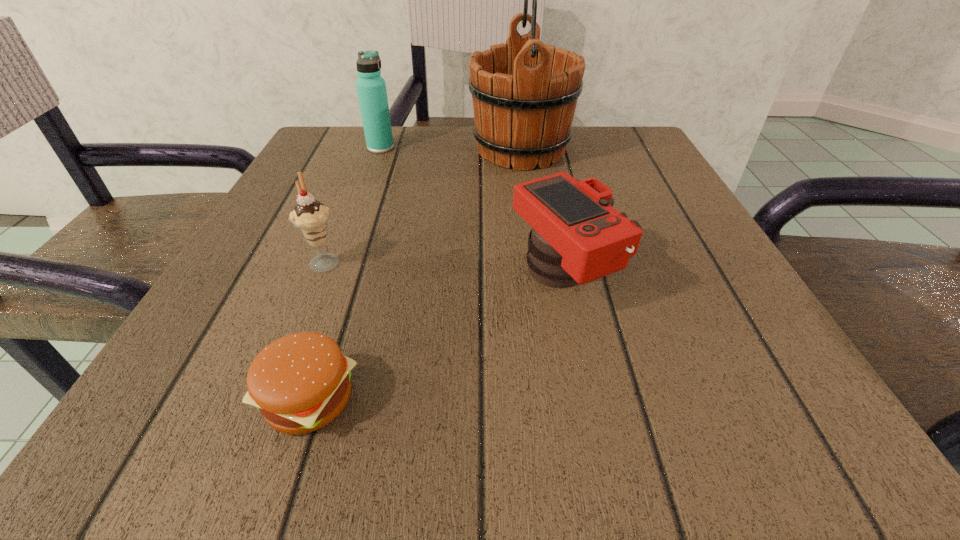
Locate an element on the screen. The width and height of the screenshot is (960, 540). the tallest object is located at coordinates (524, 92).

You are a GUI agent. You are given a task and a screenshot of the screen. Output one action in this format:
    pyautogui.click(x=<x>, y=<y>)
    Task: Click on the second tallest object
    
    Given the screenshot: What is the action you would take?
    pyautogui.click(x=371, y=88)

At what (x,y) coordinates should I click in order to perform the action: click on icecream. Please return your answer as a coordinate pair (x, y). Image resolution: width=960 pixels, height=540 pixels. Looking at the image, I should click on (311, 217).

The width and height of the screenshot is (960, 540). I want to click on camera, so click(577, 236).

Find the location of a particular element. the nearest object is located at coordinates (300, 382).

At what (x,y) coordinates should I click in order to perform the action: click on hamburger. Please return your answer as a coordinate pair (x, y). Looking at the image, I should click on (300, 382).

This screenshot has width=960, height=540. What are the coordinates of `vacant space situated on the front of the tallest object` in the screenshot? It's located at (531, 217).

Find the location of a particular element. vacant space located on the right of the thermos bottle is located at coordinates (516, 147).

This screenshot has height=540, width=960. In order to click on vacant space located on the front of the icecream in this screenshot , I will do `click(309, 300)`.

Identify the location of free space located on the back of the camera. Image resolution: width=960 pixels, height=540 pixels. (537, 148).